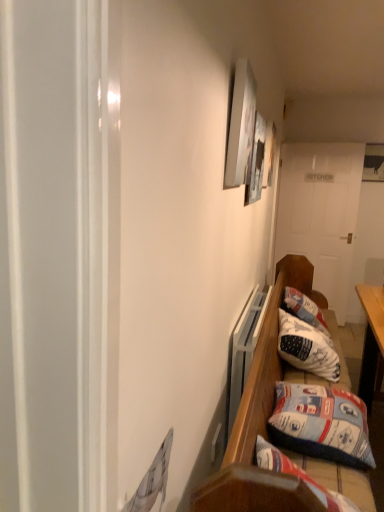
Question: Can you confirm if white wooden door at center is bigger than white fabric pillow at lower right, the 2th pillow in the front-to-back sequence?

Choices:
 (A) no
 (B) yes

Answer: (B)

Question: Could you tell me if white wooden door at center is facing white fabric pillow at lower right, positioned as the first pillow in back-to-front order?

Choices:
 (A) yes
 (B) no

Answer: (A)

Question: Is white wooden door at center touching white fabric pillow at lower right, positioned as the first pillow in back-to-front order?

Choices:
 (A) no
 (B) yes

Answer: (A)

Question: Is white fabric pillow at lower right, positioned as the first pillow in back-to-front order, a part of white wooden door at center?

Choices:
 (A) yes
 (B) no

Answer: (B)

Question: Considering the relative positions of white wooden door at center and white fabric pillow at lower right, positioned as the first pillow in back-to-front order, in the image provided, is white wooden door at center behind white fabric pillow at lower right, positioned as the first pillow in back-to-front order,?

Choices:
 (A) yes
 (B) no

Answer: (A)

Question: Can you confirm if white wooden door at center is taller than white fabric pillow at lower right, the 2th pillow in the front-to-back sequence?

Choices:
 (A) no
 (B) yes

Answer: (B)

Question: From the image's perspective, would you say blue fabric pillow at lower right, positioned as the 2th pillow in back-to-front order, is positioned over metallic silver picture frame at upper center, arranged as the first picture frame when viewed from the back?

Choices:
 (A) no
 (B) yes

Answer: (A)

Question: Is blue fabric pillow at lower right, which ranks as the first pillow in front-to-back order, in front of metallic silver picture frame at upper center, which is the second picture frame from front to back?

Choices:
 (A) yes
 (B) no

Answer: (A)

Question: Does blue fabric pillow at lower right, positioned as the 2th pillow in back-to-front order, have a lesser width compared to metallic silver picture frame at upper center, the 2th picture frame when ordered from left to right?

Choices:
 (A) yes
 (B) no

Answer: (B)

Question: Does blue fabric pillow at lower right, which ranks as the first pillow in front-to-back order, appear on the left side of metallic silver picture frame at upper center, arranged as the first picture frame when viewed from the back?

Choices:
 (A) no
 (B) yes

Answer: (A)

Question: From the image's perspective, would you say blue fabric pillow at lower right, positioned as the 2th pillow in back-to-front order, is shown under metallic silver picture frame at upper center, arranged as the first picture frame when viewed from the back?

Choices:
 (A) no
 (B) yes

Answer: (B)

Question: Is blue fabric pillow at lower right, which ranks as the first pillow in front-to-back order, oriented towards metallic silver picture frame at upper center, the 2th picture frame when ordered from left to right?

Choices:
 (A) yes
 (B) no

Answer: (B)

Question: Is white wooden door at center positioned far away from matte white picture frame at upper center, which is the first picture frame in front-to-back order?

Choices:
 (A) yes
 (B) no

Answer: (A)